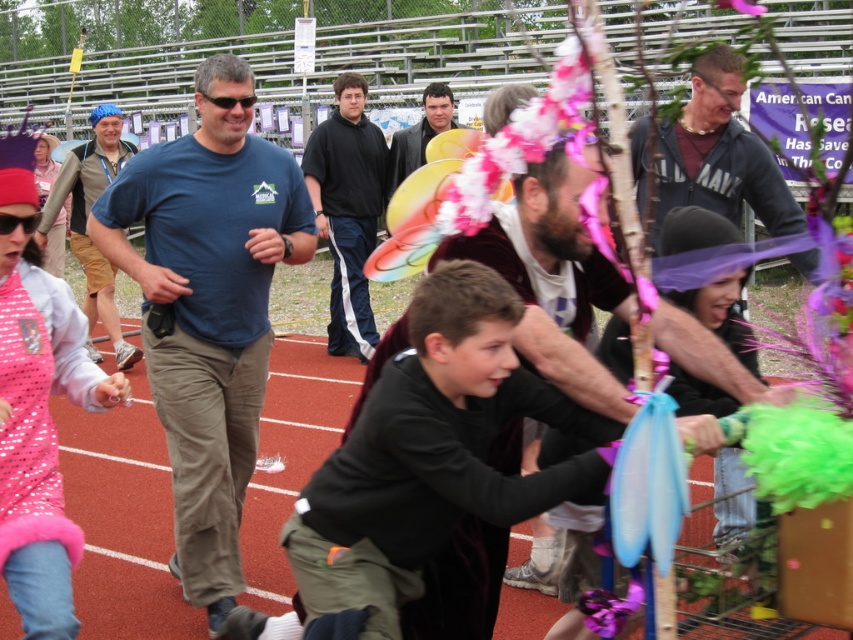
Looking at this image, between blue cotton t-shirt at center and black matte jacket at upper center, which one is positioned lower?

blue cotton t-shirt at center

Does blue cotton t-shirt at center have a greater width compared to black matte jacket at upper center?

Correct, the width of blue cotton t-shirt at center exceeds that of black matte jacket at upper center.

Between point (212, 376) and point (786, 186), which one is positioned in front?

Point (212, 376) is in front.

Where is `blue cotton t-shirt at center`? The image size is (853, 640). blue cotton t-shirt at center is located at coordinates (207, 307).

Does velvet burgundy cape at center have a lesser width compared to pink sequined dress at center?

Incorrect, velvet burgundy cape at center's width is not less than pink sequined dress at center's.

Which is above, velvet burgundy cape at center or pink sequined dress at center?

Positioned higher is velvet burgundy cape at center.

Between point (712, 362) and point (9, 369), which one is positioned in front?

Point (712, 362) is in front.

The height and width of the screenshot is (640, 853). I want to click on velvet burgundy cape at center, so click(553, 278).

Is blue cotton t-shirt at center further to camera compared to velvet burgundy cape at center?

Yes, it is behind velvet burgundy cape at center.

Between point (213, 384) and point (508, 236), which one is positioned behind?

Point (213, 384)

The height and width of the screenshot is (640, 853). Describe the element at coordinates (207, 307) in the screenshot. I see `blue cotton t-shirt at center` at that location.

The width and height of the screenshot is (853, 640). I want to click on blue cotton t-shirt at center, so click(x=207, y=307).